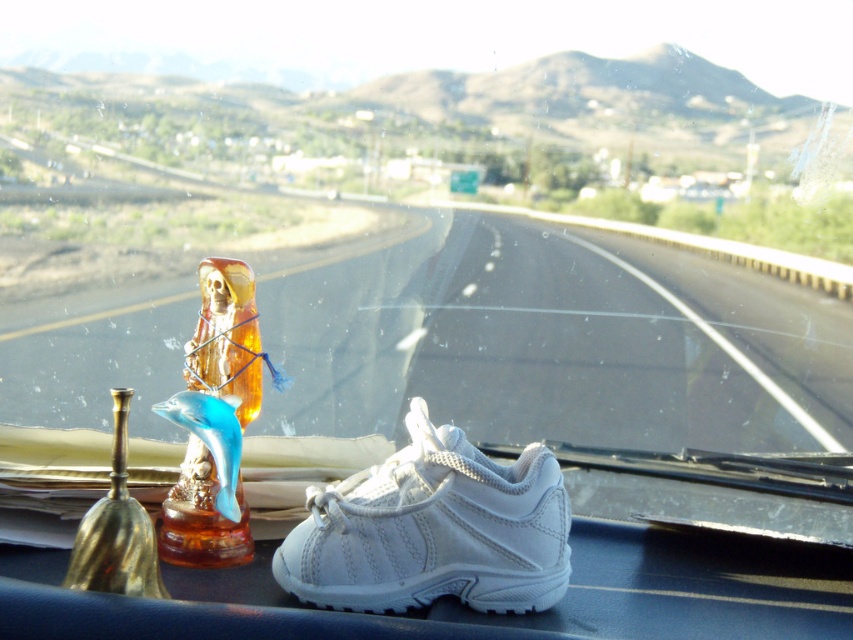
Question: Does white leather shoe at center appear on the right side of translucent amber glass figurine at center?

Choices:
 (A) no
 (B) yes

Answer: (B)

Question: From the image, what is the correct spatial relationship of white leather shoe at center in relation to translucent amber glass figurine at center?

Choices:
 (A) left
 (B) right

Answer: (B)

Question: Among these objects, which one is nearest to the camera?

Choices:
 (A) translucent amber glass figurine at center
 (B) white leather shoe at center

Answer: (A)

Question: Which point is closer to the camera?

Choices:
 (A) (236, 506)
 (B) (442, 593)

Answer: (B)

Question: Does white leather shoe at center appear over translucent amber glass figurine at center?

Choices:
 (A) yes
 (B) no

Answer: (B)